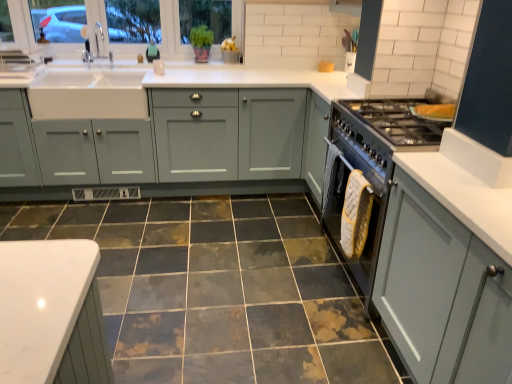
Where is `marbled ceramic tile at center`? The height and width of the screenshot is (384, 512). marbled ceramic tile at center is located at coordinates (218, 290).

Locate an element on the screen. The width and height of the screenshot is (512, 384). matte gray cabinets at center, placed as the 1th cabinetry when sorted from top to bottom is located at coordinates (186, 146).

What do you see at coordinates (186, 146) in the screenshot? Image resolution: width=512 pixels, height=384 pixels. I see `matte gray cabinets at center, the 2th cabinetry when ordered from bottom to top` at bounding box center [186, 146].

Where is `clear glass window at upper left`? This screenshot has width=512, height=384. clear glass window at upper left is located at coordinates (98, 29).

What's the angular difference between stainless steel oven at right and clear glass window at upper left's facing directions?

The angle between the facing direction of stainless steel oven at right and the facing direction of clear glass window at upper left is 89.3 degrees.

Is stainless steel oven at right wider than clear glass window at upper left?

Yes, stainless steel oven at right is wider than clear glass window at upper left.

What are the coordinates of `appliance below the clear glass window at upper left (from the image's perspective)` in the screenshot? It's located at (372, 166).

Can you confirm if teal matte soap dispenser at upper center is wider than matte gray cabinets at center, arranged as the 2th cabinetry when viewed from the front?

In fact, teal matte soap dispenser at upper center might be narrower than matte gray cabinets at center, arranged as the 2th cabinetry when viewed from the front.

Is teal matte soap dispenser at upper center placed right next to matte gray cabinets at center, the 1th cabinetry viewed from the left?

teal matte soap dispenser at upper center and matte gray cabinets at center, the 1th cabinetry viewed from the left, are clearly separated.

From the image's perspective, which object appears higher, teal matte soap dispenser at upper center or matte gray cabinets at center, arranged as the 2th cabinetry when viewed from the front?

teal matte soap dispenser at upper center, from the image's perspective.

Is teal matte soap dispenser at upper center at the left side of matte gray cabinets at center, the 1th cabinetry viewed from the back?

No, teal matte soap dispenser at upper center is not to the left of matte gray cabinets at center, the 1th cabinetry viewed from the back.

Can stainless steel oven at right be found inside teal matte soap dispenser at upper center?

Actually, stainless steel oven at right is outside teal matte soap dispenser at upper center.

From a real-world perspective, is teal matte soap dispenser at upper center positioned above or below stainless steel oven at right?

From a real-world perspective, teal matte soap dispenser at upper center is physically above stainless steel oven at right.

From the image's perspective, would you say teal matte soap dispenser at upper center is positioned over stainless steel oven at right?

Indeed, from the image's perspective, teal matte soap dispenser at upper center is shown above stainless steel oven at right.

You are a GUI agent. You are given a task and a screenshot of the screen. Output one action in this format:
    pyautogui.click(x=<x>, y=<y>)
    Task: Click on the appliance on the right of teal matte soap dispenser at upper center
    This screenshot has height=384, width=512.
    Given the screenshot: What is the action you would take?
    pyautogui.click(x=372, y=166)

You are a GUI agent. You are given a task and a screenshot of the screen. Output one action in this format:
    pyautogui.click(x=<x>, y=<y>)
    Task: Click on the appliance positioned vertically above the matte gray cabinets at center, the 1th cabinetry viewed from the back (from a real-world perspective)
    
    Given the screenshot: What is the action you would take?
    pyautogui.click(x=372, y=166)

From the image's perspective, is matte gray cabinets at center, placed as the 1th cabinetry when sorted from top to bottom, above stainless steel oven at right?

Indeed, from the image's perspective, matte gray cabinets at center, placed as the 1th cabinetry when sorted from top to bottom, is shown above stainless steel oven at right.

How many degrees apart are the facing directions of matte gray cabinets at center, the 1th cabinetry viewed from the back, and stainless steel oven at right?

matte gray cabinets at center, the 1th cabinetry viewed from the back, and stainless steel oven at right are facing 89.9 degrees away from each other.

Does point (446, 378) lie behind point (384, 127)?

No, (446, 378) is in front of (384, 127).

Is matte gray cabinet at right, the 1th cabinetry in the front-to-back sequence, turned away from stainless steel oven at right?

That's not correct — matte gray cabinet at right, the 1th cabinetry in the front-to-back sequence, is not looking away from stainless steel oven at right.

Does matte gray cabinet at right, the 2th cabinetry positioned from the left, have a lesser width compared to stainless steel oven at right?

No, matte gray cabinet at right, the 2th cabinetry positioned from the left, is not thinner than stainless steel oven at right.

From a real-world perspective, which object rests below the other?

From a 3D spatial view, matte gray cabinet at right, the 2th cabinetry positioned from the left, is below.

From the image's perspective, which one is positioned higher, matte gray cabinet at right, the first cabinetry ordered from the bottom, or marbled ceramic tile at center?

matte gray cabinet at right, the first cabinetry ordered from the bottom, from the image's perspective.

Which object is positioned more to the left, matte gray cabinet at right, the 1th cabinetry in the front-to-back sequence, or marbled ceramic tile at center?

Positioned to the left is marbled ceramic tile at center.

Is point (490, 346) positioned after point (257, 286)?

No.

From a real-world perspective, which object rests below the other?

From a 3D spatial view, marbled ceramic tile at center is below.

From the picture: Does marbled ceramic tile at center lie behind matte gray cabinet at right, the first cabinetry ordered from the bottom?

Yes, marbled ceramic tile at center is further from the viewer.

From a real-world perspective, is marbled ceramic tile at center located beneath matte gray cabinet at right, the 1th cabinetry in the front-to-back sequence?

Indeed, from a real-world perspective, marbled ceramic tile at center is positioned beneath matte gray cabinet at right, the 1th cabinetry in the front-to-back sequence.

Looking at this image, looking at the image, does marbled ceramic tile at center seem bigger or smaller compared to matte gray cabinet at right, the 1th cabinetry in the front-to-back sequence?

Considering their sizes, marbled ceramic tile at center takes up less space than matte gray cabinet at right, the 1th cabinetry in the front-to-back sequence.

Could you measure the distance between marbled ceramic tile at center and matte gray cabinet at right, which appears as the first cabinetry when viewed from the right?

marbled ceramic tile at center is 38.22 inches from matte gray cabinet at right, which appears as the first cabinetry when viewed from the right.

Where is `window screen lying behind the stainless steel oven at right`? window screen lying behind the stainless steel oven at right is located at coordinates (98, 29).

Identify the location of cabinetry that is the 1st one when counting downward from the teal matte soap dispenser at upper center (from the image's perspective). (186, 146).

Which object lies nearer to the anchor point marbled ceramic tile at center, stainless steel oven at right or matte gray cabinet at right, which appears as the 2th cabinetry when viewed from the back?

stainless steel oven at right is closer to marbled ceramic tile at center.

Estimate the real-world distances between objects in this image. Which object is further from clear glass window at upper left, matte gray cabinet at right, the 1th cabinetry in the front-to-back sequence, or marbled ceramic tile at center?

Based on the image, matte gray cabinet at right, the 1th cabinetry in the front-to-back sequence, appears to be further to clear glass window at upper left.

Based on their spatial positions, is clear glass window at upper left or matte gray cabinets at center, the 1th cabinetry viewed from the back, further from marbled ceramic tile at center?

The object further to marbled ceramic tile at center is clear glass window at upper left.

Looking at the image, which one is located closer to teal matte soap dispenser at upper center, clear glass window at upper left or stainless steel oven at right?

clear glass window at upper left is positioned closer to the anchor teal matte soap dispenser at upper center.

In the scene shown: Estimate the real-world distances between objects in this image. Which object is further from clear glass window at upper left, matte gray cabinets at center, the 2th cabinetry when ordered from bottom to top, or marbled ceramic tile at center?

Among the two, marbled ceramic tile at center is located further to clear glass window at upper left.

Which object lies further to the anchor point clear glass window at upper left, teal matte soap dispenser at upper center or matte gray cabinets at center, the 1th cabinetry viewed from the back?

Among the two, matte gray cabinets at center, the 1th cabinetry viewed from the back, is located further to clear glass window at upper left.

Estimate the real-world distances between objects in this image. Which object is closer to marbled ceramic tile at center, matte gray cabinets at center, arranged as the 2th cabinetry when viewed from the front, or stainless steel oven at right?

Based on the image, matte gray cabinets at center, arranged as the 2th cabinetry when viewed from the front, appears to be nearer to marbled ceramic tile at center.

Looking at the image, which one is located further to clear glass window at upper left, marbled ceramic tile at center or teal matte soap dispenser at upper center?

marbled ceramic tile at center is further to clear glass window at upper left.

This screenshot has width=512, height=384. In order to click on teal between matte gray cabinets at center, which ranks as the second cabinetry in right-to-left order, and stainless steel oven at right, in the horizontal direction in this screenshot , I will do `click(152, 52)`.

Locate an element on the screen. The width and height of the screenshot is (512, 384). teal between clear glass window at upper left and stainless steel oven at right is located at coordinates (152, 52).

Find the location of a particular element. This screenshot has height=384, width=512. ceramic tile between matte gray cabinet at right, which appears as the 2th cabinetry when viewed from the back, and teal matte soap dispenser at upper center from front to back is located at coordinates (218, 290).

The image size is (512, 384). Find the location of `ceramic tile between matte gray cabinet at right, which appears as the 2th cabinetry when viewed from the back, and clear glass window at upper left in the front-back direction`. ceramic tile between matte gray cabinet at right, which appears as the 2th cabinetry when viewed from the back, and clear glass window at upper left in the front-back direction is located at coordinates (218, 290).